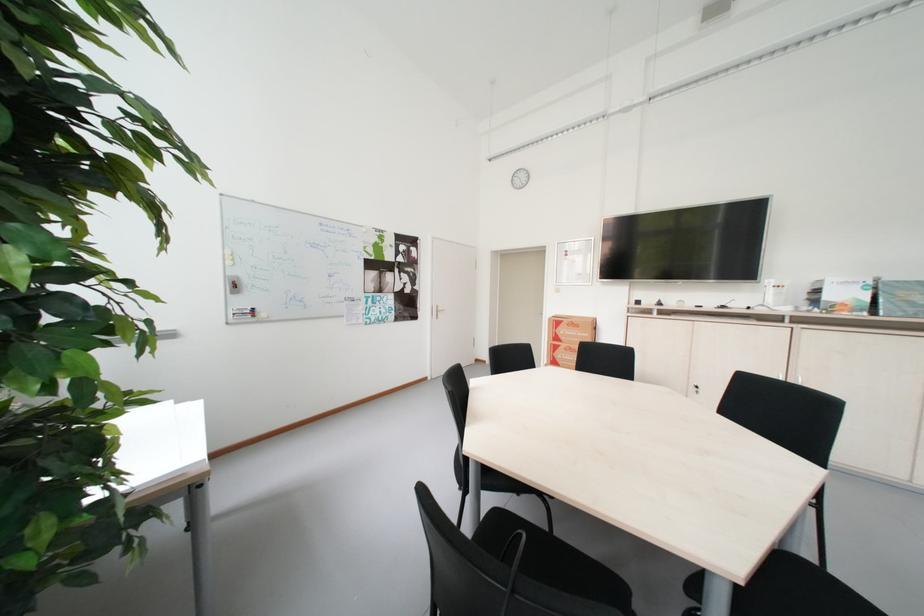
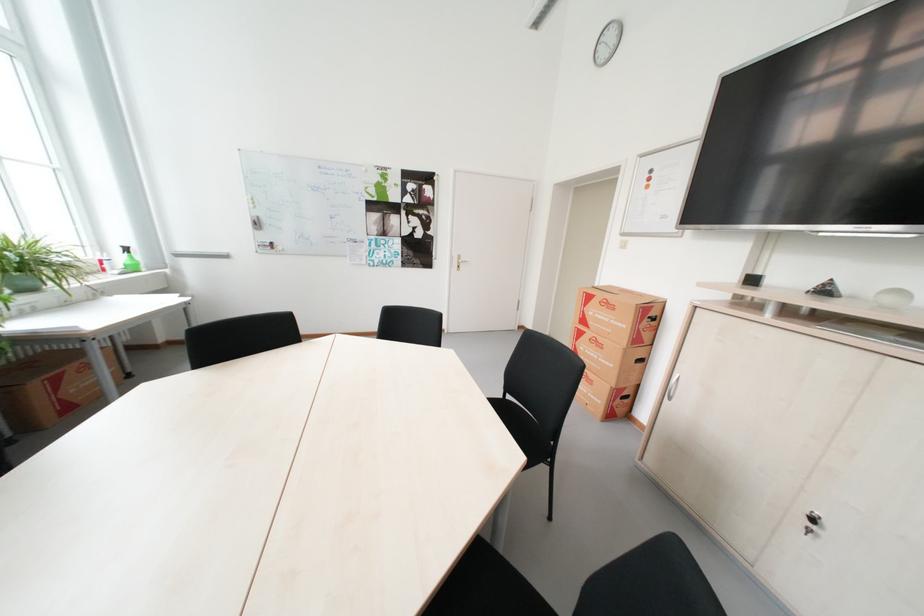
Question: I am providing you with two images of the same scene from different viewpoints. Which of the following objects are not visible in image2?

Choices:
 (A) green spray bottle
 (B) cardboard box
 (C) black chair sitting surface
 (D) grey roll pillow

Answer: (C)